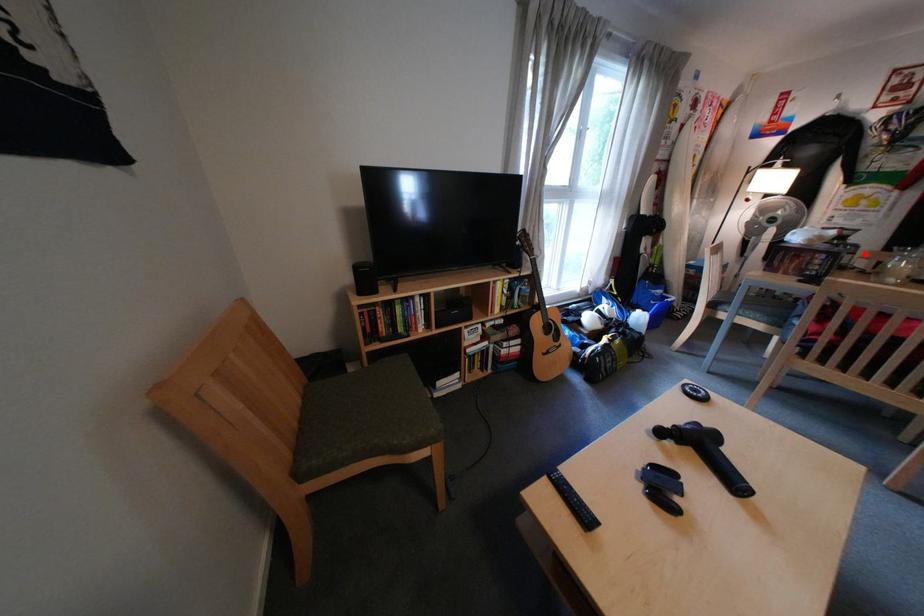
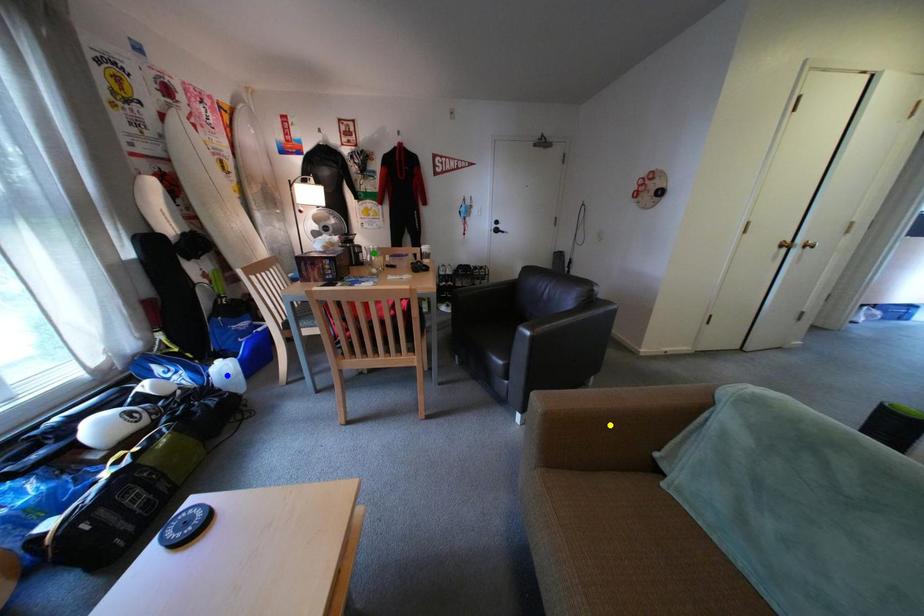
Question: I am providing you with two images of the same scene from different viewpoints. A red point is marked on the first image. You are given multiple points on the second image. Which point in image 2 is actually the same real-world point as the red point in image 1?

Choices:
 (A) yellow point
 (B) blue point
 (C) green point

Answer: (C)